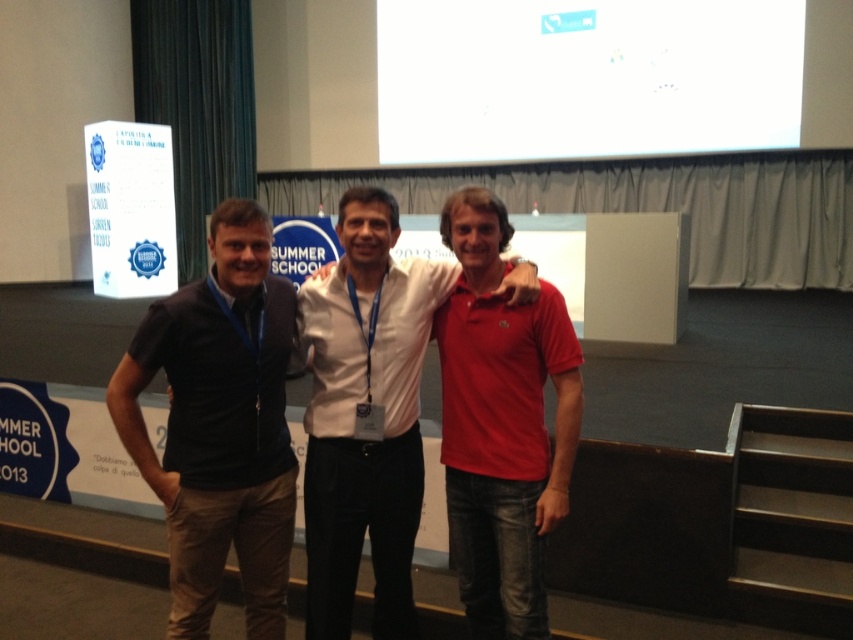
You are a photographer at the Summer School 2013 event, and you need to capture a clear photo of both the white cotton shirt at center and the red cotton polo shirt at center. Which one should you focus on first to ensure it appears sharp in the photo?

The white cotton shirt at center is further to the viewer than the red cotton polo shirt at center, so you should focus on the white cotton shirt at center first to ensure both appear sharp.

Where is the white matte projection screen at upper center located in the image?

The white matte projection screen at upper center is located at point (585, 77) in the image.

You are an event photographer trying to capture a clear photo of the white cotton shirt at center. However, there is a white matte projection screen at upper center in the way. Can you adjust your camera angle to avoid the screen while still framing the shirt?

The white cotton shirt at center is behind the white matte projection screen at upper center. Since the shirt is behind the screen, adjusting the camera angle might not be possible without moving either the screen or the subject. However, if the screen is transparent or semi transparent, you could position the camera so that both are in focus with proper lighting. Alternatively, moving closer to the screen while focusing on the shirt might work if the screen allows visibility.